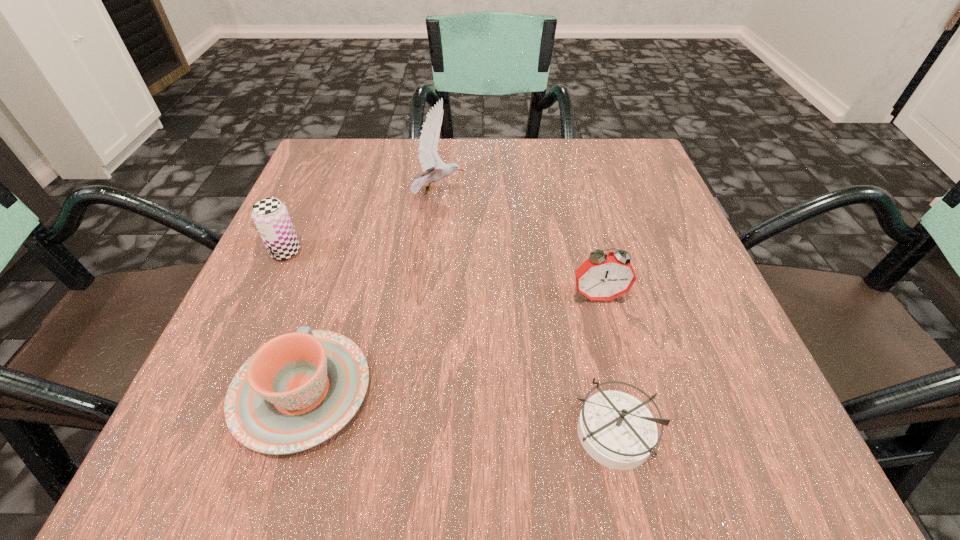
I want to click on the farthest object, so click(x=434, y=169).

Where is `the third object from right to left`? The image size is (960, 540). the third object from right to left is located at coordinates (434, 169).

You are a GUI agent. You are given a task and a screenshot of the screen. Output one action in this format:
    pyautogui.click(x=<x>, y=<y>)
    Task: Click on the third nearest object
    This screenshot has width=960, height=540.
    Given the screenshot: What is the action you would take?
    pyautogui.click(x=602, y=277)

Find the location of a particular element. The height and width of the screenshot is (540, 960). the second farthest object is located at coordinates (271, 217).

Identify the location of chinaware. The image size is (960, 540). (299, 389).

Where is `compass`? The height and width of the screenshot is (540, 960). compass is located at coordinates (617, 430).

At what (x,y) coordinates should I click in order to perform the action: click on vacant space located at the tip of the beak of the tallest object. Please return your answer as a coordinate pair (x, y). The height and width of the screenshot is (540, 960). Looking at the image, I should click on (628, 193).

Find the location of a particular element. Image resolution: width=960 pixels, height=540 pixels. free space located on the clock face of the third nearest object is located at coordinates pyautogui.click(x=615, y=364).

Identify the location of vacant space located on the right of the second farthest object. The width and height of the screenshot is (960, 540). (401, 252).

I want to click on free space located 0.300m on the handle side of the chinaware, so click(x=357, y=214).